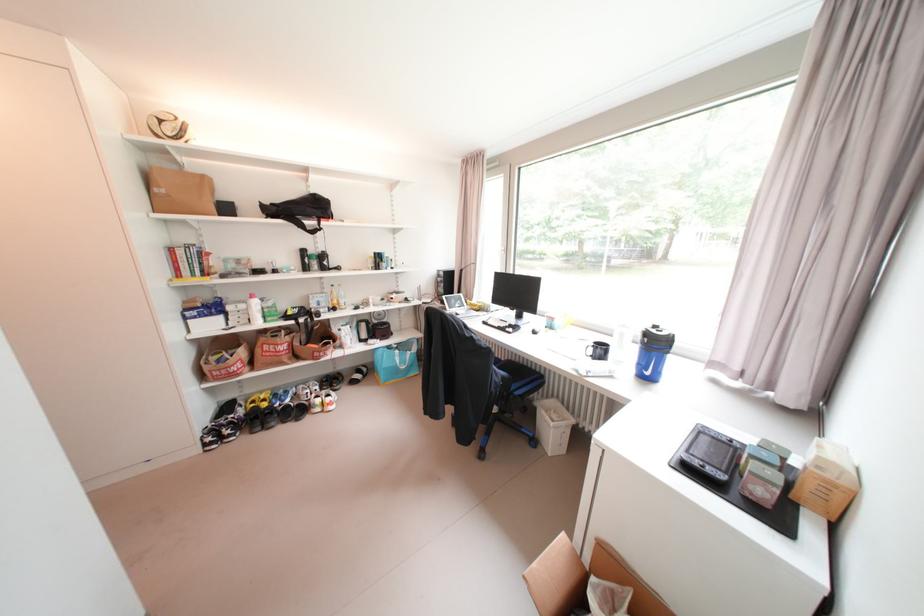
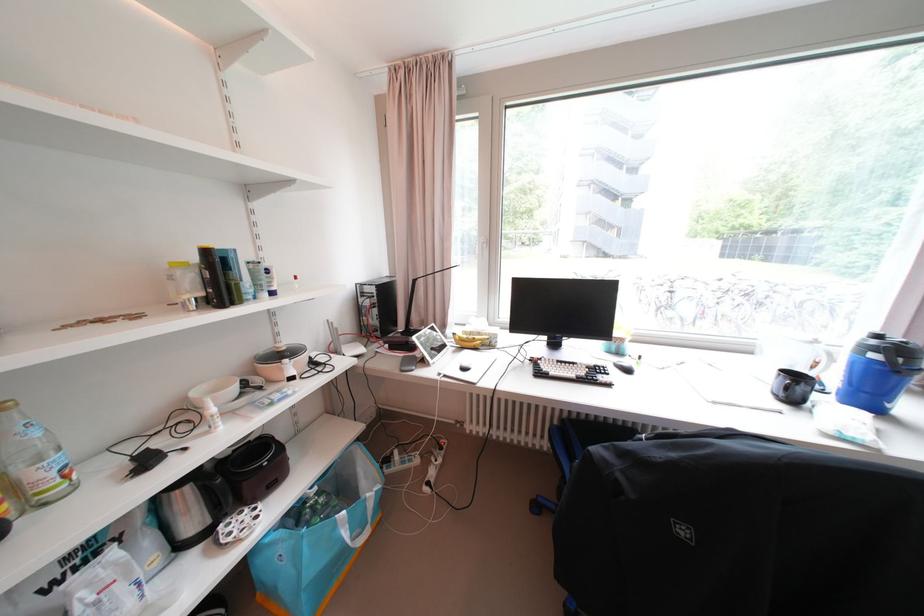
Where in the second image is the point corresponding to (x=525, y=317) from the first image?

(555, 346)